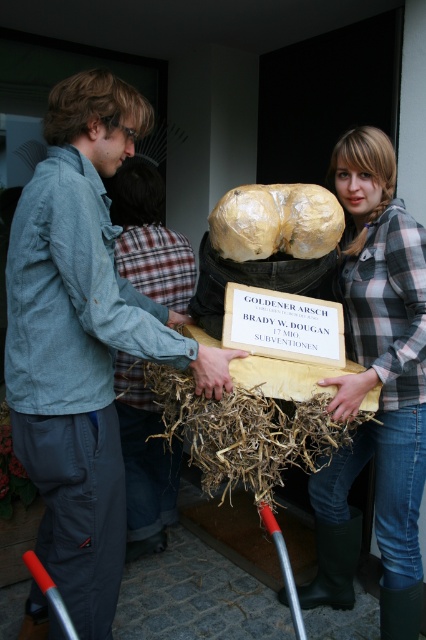
Who is higher up, light blue denim jacket at center or plaid flannel shirt at center?

light blue denim jacket at center is higher up.

Is light blue denim jacket at center wider than plaid flannel shirt at center?

Yes.

Find the location of a particular element. The width and height of the screenshot is (426, 640). light blue denim jacket at center is located at coordinates (83, 340).

Is point (95, 560) more distant than point (227, 456)?

No.

Between point (103, 314) and point (184, 433), which one is positioned in front?

Point (103, 314)

Image resolution: width=426 pixels, height=640 pixels. I want to click on light blue denim jacket at center, so click(x=83, y=340).

Is light blue denim jacket at center shorter than gold-brown waxed sculpture at center?

Incorrect, light blue denim jacket at center's height does not fall short of gold-brown waxed sculpture at center's.

Is the position of light blue denim jacket at center more distant than that of gold-brown waxed sculpture at center?

No.

Between point (77, 156) and point (324, 208), which one is positioned in front?

Point (77, 156)

Find the location of `light blue denim jacket at center`. light blue denim jacket at center is located at coordinates (83, 340).